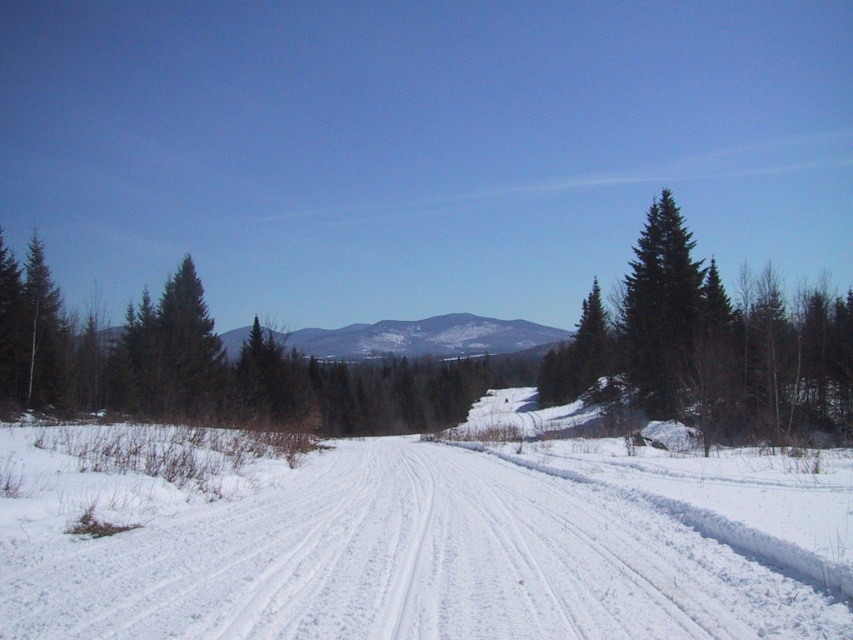
Question: From the image, what is the correct spatial relationship of green needle-like tree at right in relation to green matte tree at center?

Choices:
 (A) right
 (B) left

Answer: (B)

Question: Based on their relative distances, which object is nearer to the green matte tree at center?

Choices:
 (A) green matte tree at left
 (B) green needle-like tree at right

Answer: (B)

Question: Can you confirm if green matte tree at left is positioned to the left of green matte tree at center?

Choices:
 (A) yes
 (B) no

Answer: (A)

Question: Among these objects, which one is nearest to the camera?

Choices:
 (A) green needle-like tree at right
 (B) green matte tree at left
 (C) green matte tree at center

Answer: (A)

Question: Is green matte tree at left bigger than green matte tree at center?

Choices:
 (A) yes
 (B) no

Answer: (B)

Question: Which point is farther to the camera?

Choices:
 (A) green needle-like tree at right
 (B) green matte tree at center
 (C) green matte tree at left

Answer: (B)